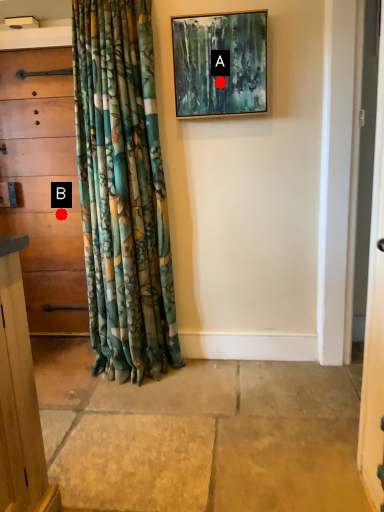
Question: Two points are circled on the image, labeled by A and B beside each circle. Which point is farther to the camera?

Choices:
 (A) A is further
 (B) B is further

Answer: (B)